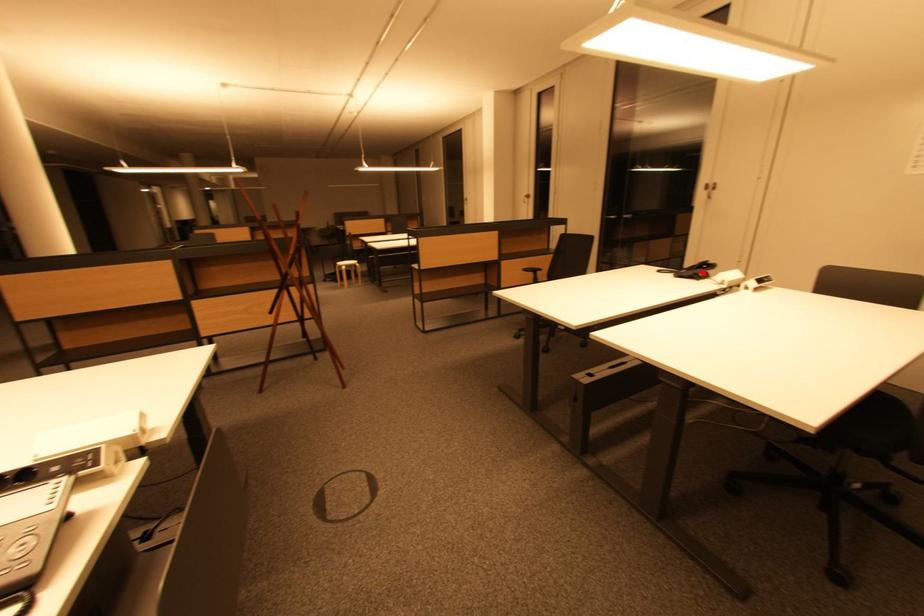
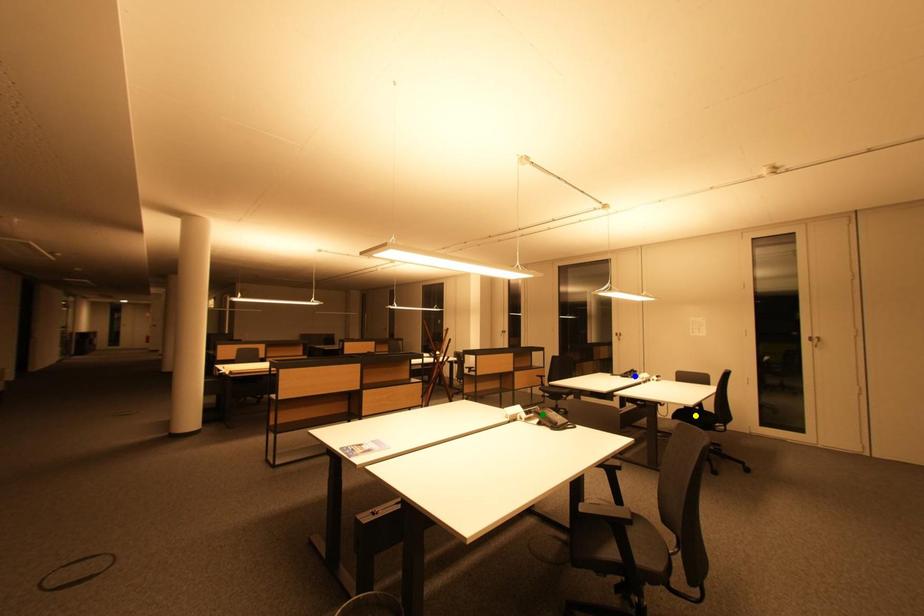
Question: I am providing you with two images of the same scene from different viewpoints. A red point is marked on the first image. You are given multiple points on the second image. Can you choose the point in image 2 that corresponds to the point in image 1?

Choices:
 (A) blue point
 (B) green point
 (C) yellow point

Answer: (A)